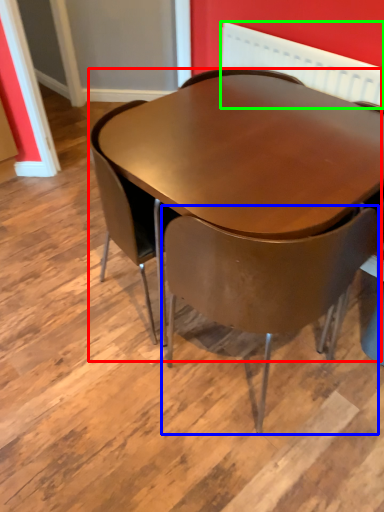
Question: Estimate the real-world distances between objects in this image. Which object is farther from table (highlighted by a red box), chair (highlighted by a blue box) or radiator (highlighted by a green box)?

Choices:
 (A) chair
 (B) radiator

Answer: (B)